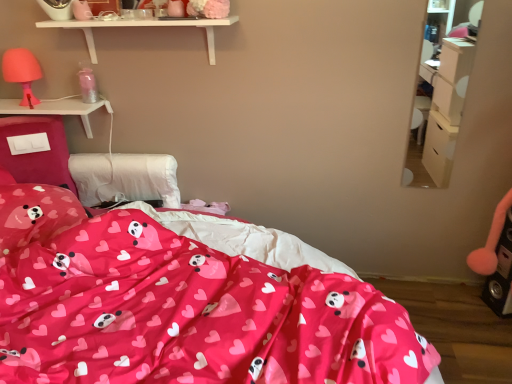
Question: Are white matte shelf at upper center and matte pink lampshade at left making contact?

Choices:
 (A) yes
 (B) no

Answer: (B)

Question: Can you confirm if white matte shelf at upper center is taller than matte pink lampshade at left?

Choices:
 (A) no
 (B) yes

Answer: (A)

Question: Is white matte shelf at upper center smaller than matte pink lampshade at left?

Choices:
 (A) yes
 (B) no

Answer: (B)

Question: Is white matte shelf at upper center to the left of matte pink lampshade at left from the viewer's perspective?

Choices:
 (A) yes
 (B) no

Answer: (B)

Question: From a real-world perspective, does white matte shelf at upper center stand above matte pink lampshade at left?

Choices:
 (A) no
 (B) yes

Answer: (B)

Question: Can we say white matte shelf at upper center lies outside matte pink lampshade at left?

Choices:
 (A) no
 (B) yes

Answer: (B)

Question: Is white plastic switch at left at the back of matte pink lampshade at left?

Choices:
 (A) yes
 (B) no

Answer: (B)

Question: Considering the relative sizes of matte pink lampshade at left and white plastic switch at left in the image provided, is matte pink lampshade at left shorter than white plastic switch at left?

Choices:
 (A) no
 (B) yes

Answer: (A)

Question: Is white plastic switch at left surrounded by matte pink lampshade at left?

Choices:
 (A) no
 (B) yes

Answer: (A)

Question: Does matte pink lampshade at left have a lesser width compared to white plastic switch at left?

Choices:
 (A) yes
 (B) no

Answer: (A)

Question: From the image's perspective, is matte pink lampshade at left below white plastic switch at left?

Choices:
 (A) yes
 (B) no

Answer: (B)

Question: Does matte pink lampshade at left come behind white plastic switch at left?

Choices:
 (A) no
 (B) yes

Answer: (A)

Question: Is matte pink pillow with heart and panda prints at lower left inside white plastic switch at left?

Choices:
 (A) no
 (B) yes

Answer: (A)